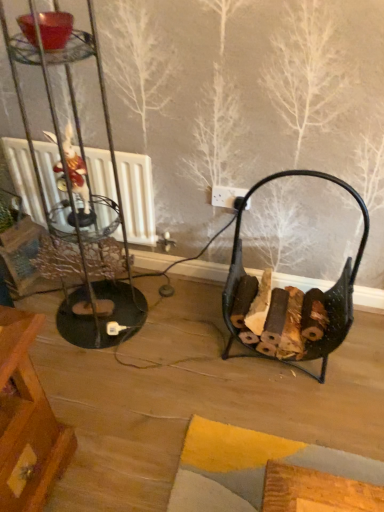
Question: Is black metal firewood basket at lower right to the left or to the right of white plastic socket at center in the image?

Choices:
 (A) left
 (B) right

Answer: (B)

Question: Is black metal firewood basket at lower right spatially inside white plastic socket at center, or outside of it?

Choices:
 (A) inside
 (B) outside

Answer: (B)

Question: From a real-world perspective, is black metal firewood basket at lower right positioned above or below white plastic socket at center?

Choices:
 (A) above
 (B) below

Answer: (B)

Question: Considering the positions of white plastic socket at center and black metal firewood basket at lower right in the image, is white plastic socket at center wider or thinner than black metal firewood basket at lower right?

Choices:
 (A) wide
 (B) thin

Answer: (B)

Question: From the image's perspective, is white plastic socket at center located above or below black metal firewood basket at lower right?

Choices:
 (A) above
 (B) below

Answer: (A)

Question: Does point pyautogui.click(x=233, y=200) appear closer or farther from the camera than point pyautogui.click(x=241, y=252)?

Choices:
 (A) closer
 (B) farther

Answer: (A)

Question: Relative to black metal firewood basket at lower right, is white plastic socket at center in front or behind?

Choices:
 (A) front
 (B) behind

Answer: (B)